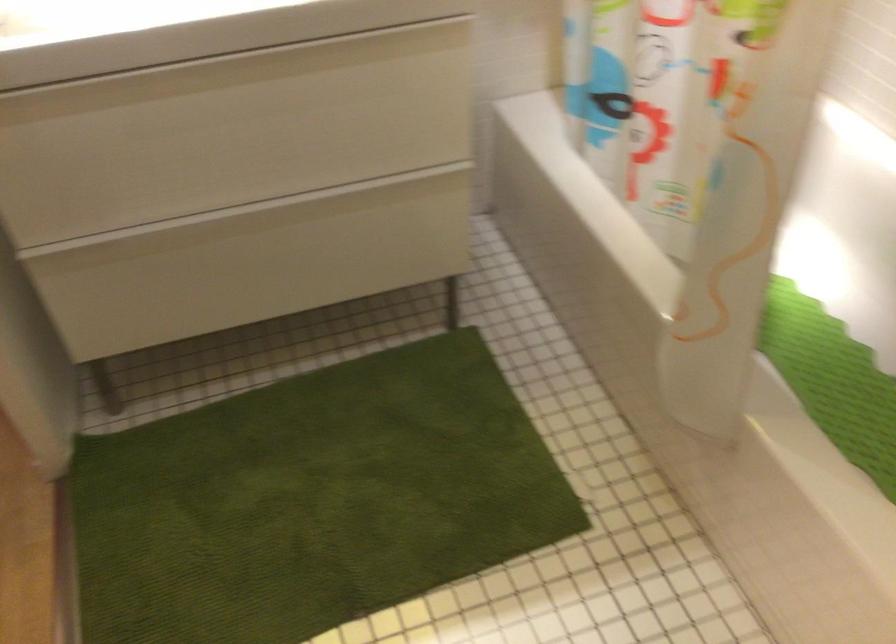
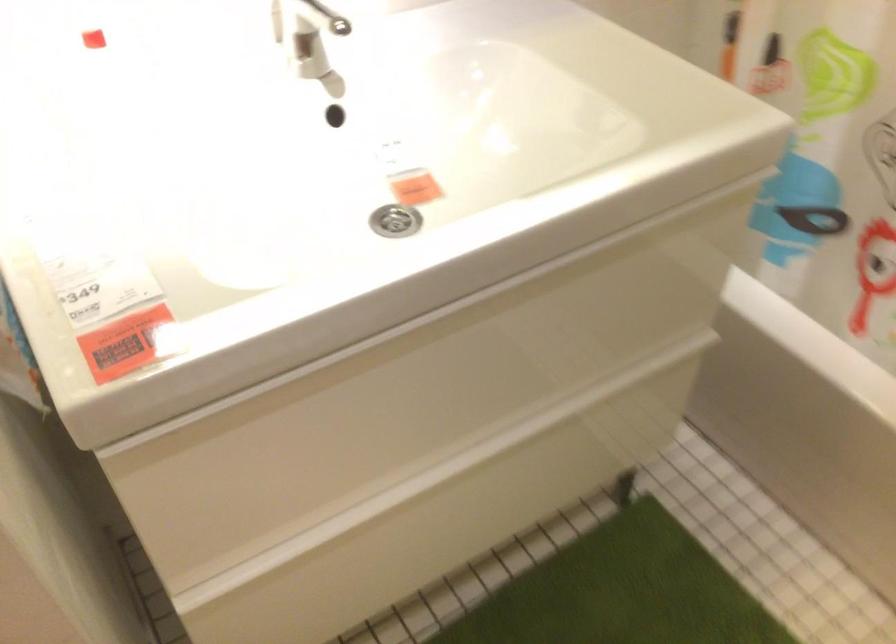
Find the pixel in the second image that matches (236,254) in the first image.

(442, 514)